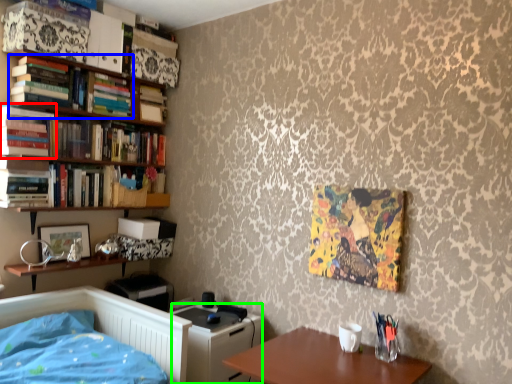
Question: Which is farther away from book (highlighted by a red box)? book (highlighted by a blue box) or file cabinet (highlighted by a green box)?

Choices:
 (A) book
 (B) file cabinet

Answer: (B)